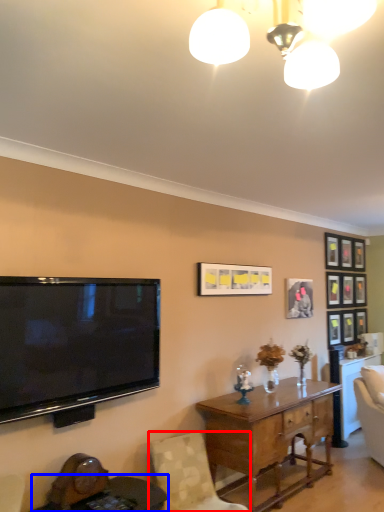
Question: Which point is further to the camera, chair (highlighted by a red box) or round table (highlighted by a blue box)?

Choices:
 (A) chair
 (B) round table

Answer: (A)